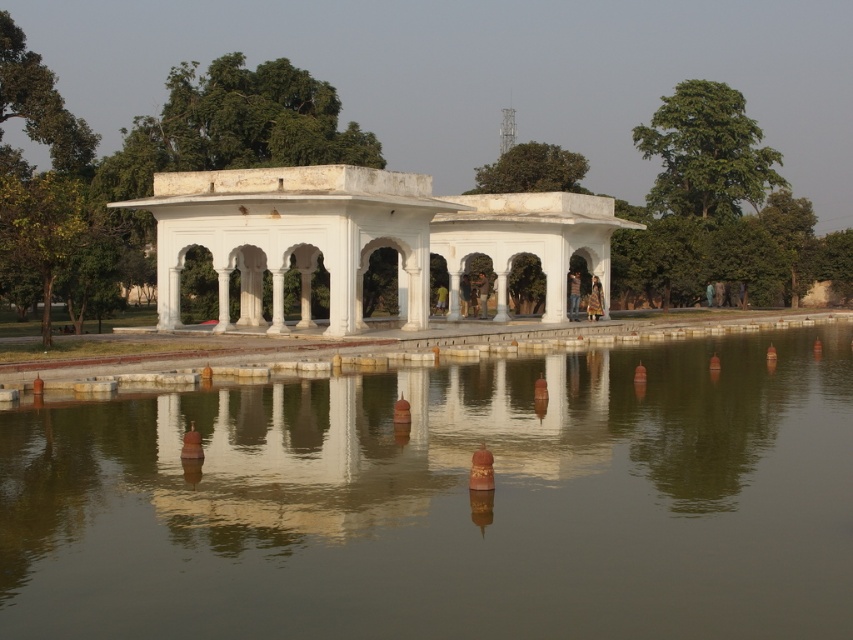
Question: Which of the following is the farthest from the observer?

Choices:
 (A) (601, 296)
 (B) (577, 296)
 (C) (828, 560)

Answer: (B)

Question: Is golden fabric dress at center bigger than brown leather jacket at center?

Choices:
 (A) yes
 (B) no

Answer: (A)

Question: Which object is the farthest from the golden fabric dress at center?

Choices:
 (A) dark brown leather jacket at center
 (B) white marble gazebo at center

Answer: (B)

Question: Is smooth reflective water at center thinner than golden fabric dress at center?

Choices:
 (A) no
 (B) yes

Answer: (A)

Question: Which point appears farthest from the camera in this image?

Choices:
 (A) (635, 221)
 (B) (358, 557)
 (C) (467, 288)
 (D) (590, 316)

Answer: (A)

Question: Does white marble gazebo at center appear over golden fabric dress at center?

Choices:
 (A) yes
 (B) no

Answer: (A)